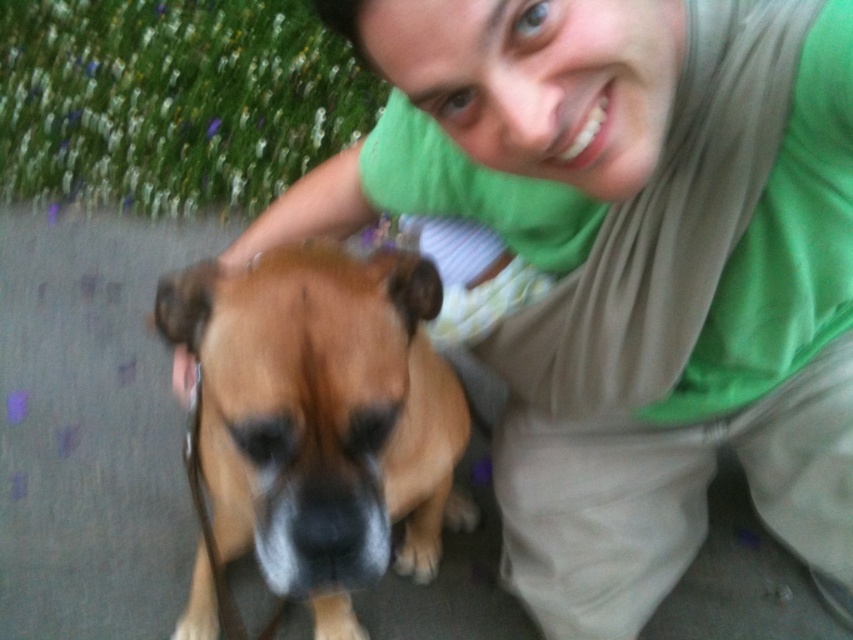
Based on the photo, you are taking a photo of the green fabric shirt at upper center and the brown fur dog at center. Which object is wider in the image?

The green fabric shirt at upper center is wider than the brown fur dog at center.

Consider the image. You are taking a photo of the green fabric shirt at upper center and the brown fur dog at center. Which object should you focus on first if you want both to be in focus?

The green fabric shirt at upper center is located above the brown fur dog at center. To get both in focus, you should focus on the brown fur dog at center first since it is closer to the camera.